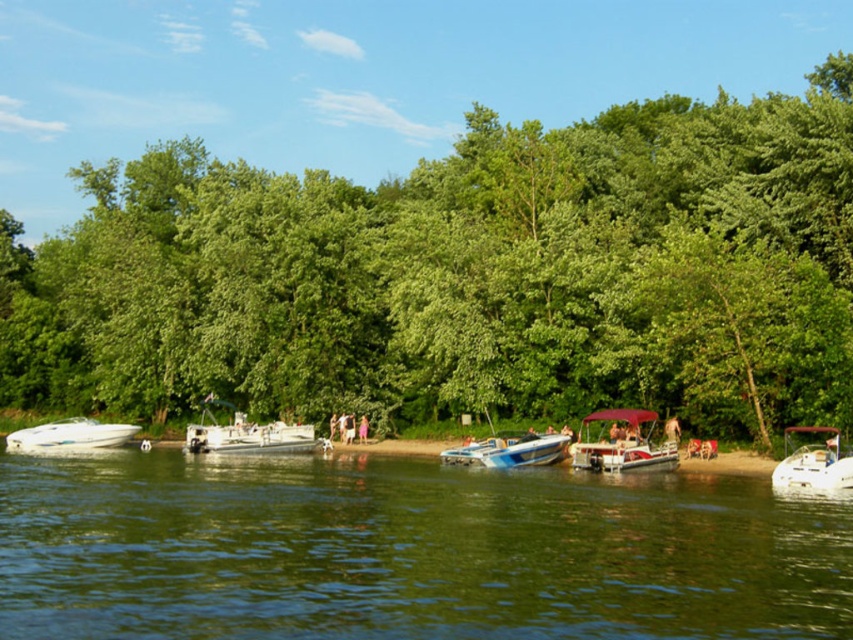
From the picture: You are planning to cross the green glossy water at center in the white plastic boat at center. Is the boat wide enough to fit you comfortably?

The green glossy water at center is wider than the white plastic boat at center, so the boat may not be wide enough to fit you comfortably across the water.

You are standing at the lakeside and want to reach a specific spot. You have two options to choose from, point A at point (96, 508) and point B at point (233, 451). Which point is closer to you?

Point A at point (96, 508) is closer to you than point B at point (233, 451).